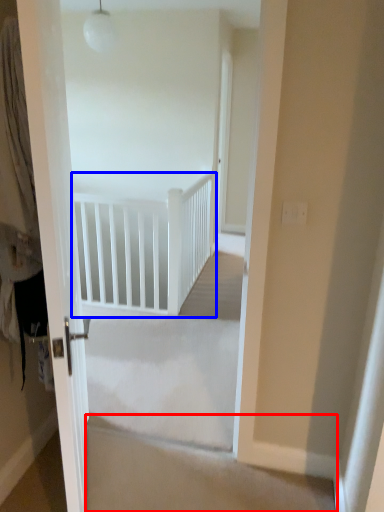
Question: Which object is further to the camera taking this photo, stairwell (highlighted by a red box) or rail (highlighted by a blue box)?

Choices:
 (A) stairwell
 (B) rail

Answer: (B)